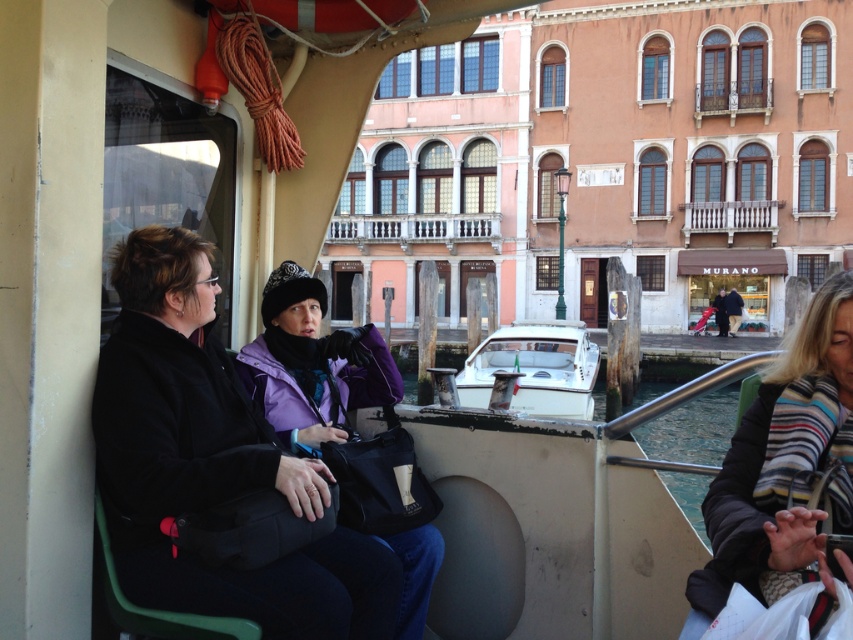
Is black fabric coach at center above white glossy boat at center?

Correct, black fabric coach at center is located above white glossy boat at center.

What do you see at coordinates (212, 461) in the screenshot? I see `black fabric coach at center` at bounding box center [212, 461].

The width and height of the screenshot is (853, 640). In order to click on black fabric coach at center in this screenshot , I will do `click(212, 461)`.

Who is higher up, striped wool scarf at lower right or white glossy boat at center?

Positioned higher is striped wool scarf at lower right.

Which is behind, point (740, 448) or point (485, 358)?

Point (485, 358)

Image resolution: width=853 pixels, height=640 pixels. In order to click on striped wool scarf at lower right in this screenshot , I will do `click(784, 468)`.

Between striped wool scarf at lower right and purple fleece jacket at center, which one is positioned higher?

purple fleece jacket at center is higher up.

Between point (746, 490) and point (267, 332), which one is positioned behind?

The point (267, 332) is behind.

You are a GUI agent. You are given a task and a screenshot of the screen. Output one action in this format:
    pyautogui.click(x=<x>, y=<y>)
    Task: Click on the striped wool scarf at lower right
    This screenshot has height=640, width=853.
    Given the screenshot: What is the action you would take?
    pyautogui.click(x=784, y=468)